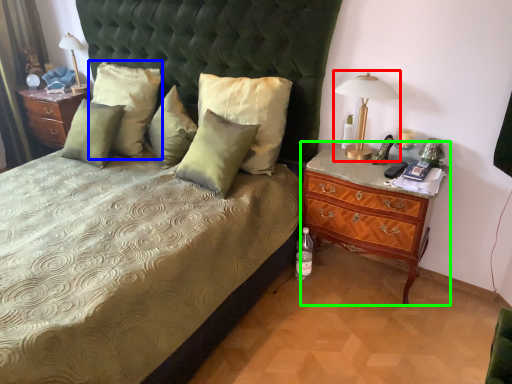
Question: Based on their relative distances, which object is farther from bedside lamp (highlighted by a red box)? Choose from pillow (highlighted by a blue box) and nightstand (highlighted by a green box).

Choices:
 (A) pillow
 (B) nightstand

Answer: (A)